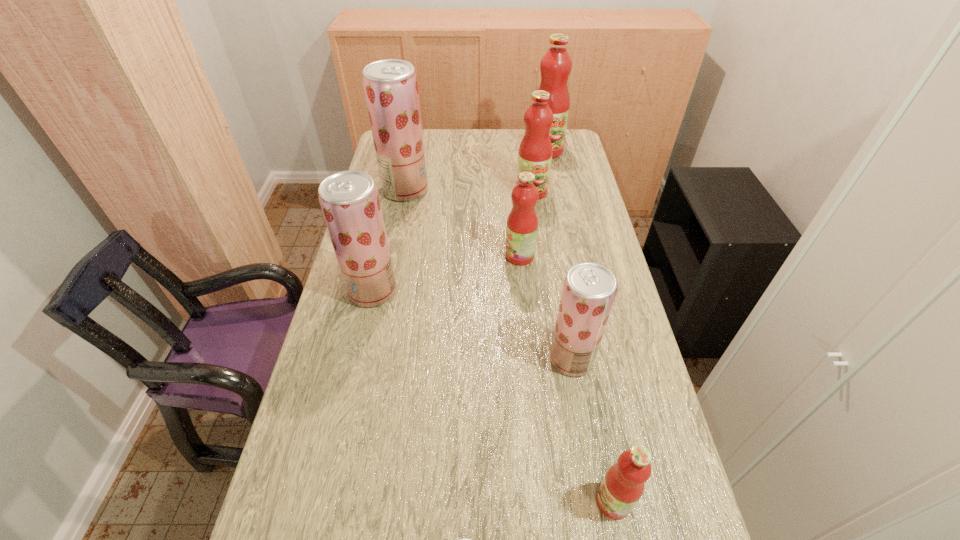
Find the location of a particular element. This screenshot has height=540, width=960. blank area located 0.310m on the front label of the second nearest object is located at coordinates (445, 501).

Locate an element on the screen. vacant space situated 0.100m on the front label of the second nearest object is located at coordinates (547, 501).

I want to click on free space located 0.380m on the front label of the second nearest object, so click(411, 501).

The width and height of the screenshot is (960, 540). What are the coordinates of `object located at the far edge` in the screenshot? It's located at (556, 64).

Find the location of a particular element. The height and width of the screenshot is (540, 960). object present at the far right corner is located at coordinates (556, 64).

This screenshot has height=540, width=960. I want to click on vacant space at the far edge of the desktop, so click(x=477, y=156).

The height and width of the screenshot is (540, 960). In the image, there is a desktop. Find the location of `vacant space at the left edge`. vacant space at the left edge is located at coordinates (291, 477).

This screenshot has width=960, height=540. In order to click on vacant region at the right edge of the desktop in this screenshot , I will do `click(564, 217)`.

The height and width of the screenshot is (540, 960). In the image, there is a desktop. Identify the location of vacant region at the far right corner. (567, 157).

You are a GUI agent. You are given a task and a screenshot of the screen. Output one action in this format:
    pyautogui.click(x=<x>, y=<y>)
    Task: Click on the blank region between the smallest pink fruit juice and the sixth farthest object
    Image resolution: width=960 pixels, height=540 pixels.
    Given the screenshot: What is the action you would take?
    pyautogui.click(x=592, y=430)